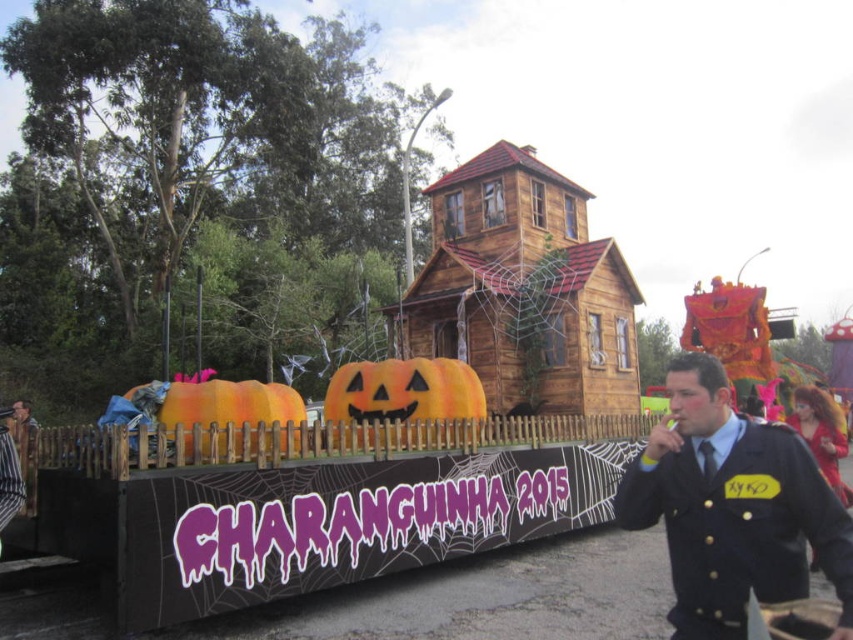
Question: Is orange matte pumpkin at lower left bigger than dark blue uniform at center?

Choices:
 (A) no
 (B) yes

Answer: (B)

Question: Where is orange matte pumpkin at lower left located in relation to dark blue uniform at center in the image?

Choices:
 (A) above
 (B) below

Answer: (A)

Question: Which of these objects is positioned farthest from the dark blue uniform at center?

Choices:
 (A) orange plush pumpkin at center
 (B) black uniform at center
 (C) orange matte pumpkin at lower left

Answer: (B)

Question: Which of the following is the farthest from the observer?

Choices:
 (A) (798, 556)
 (B) (0, 508)

Answer: (B)

Question: Which point is closer to the camera?

Choices:
 (A) (666, 472)
 (B) (445, 412)
 (C) (6, 477)

Answer: (A)

Question: Can you confirm if black uniform at center is positioned below orange matte pumpkin at lower left?

Choices:
 (A) yes
 (B) no

Answer: (A)